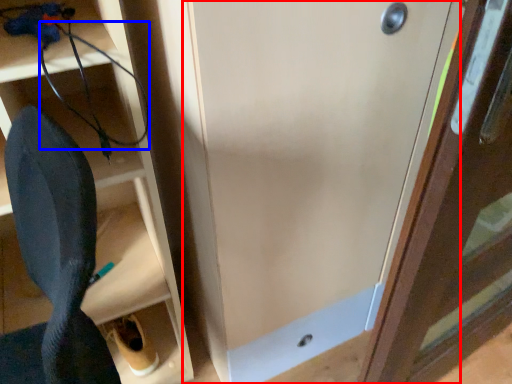
Question: Which of the following is the closest to the observer, door (highlighted by a red box) or wire (highlighted by a blue box)?

Choices:
 (A) door
 (B) wire

Answer: (A)